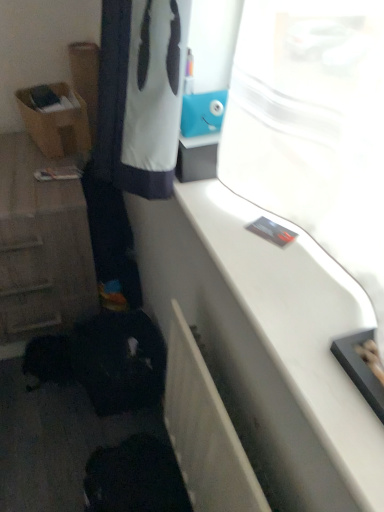
Question: Is wooden cabinet at left taller than white glossy counter top at upper right?

Choices:
 (A) yes
 (B) no

Answer: (A)

Question: Is wooden cabinet at left directly adjacent to white glossy counter top at upper right?

Choices:
 (A) yes
 (B) no

Answer: (B)

Question: Is wooden cabinet at left oriented towards white glossy counter top at upper right?

Choices:
 (A) no
 (B) yes

Answer: (A)

Question: Is the position of wooden cabinet at left less distant than that of white glossy counter top at upper right?

Choices:
 (A) yes
 (B) no

Answer: (B)

Question: Can you confirm if wooden cabinet at left is positioned to the left of white glossy counter top at upper right?

Choices:
 (A) yes
 (B) no

Answer: (A)

Question: From a real-world perspective, is brown cardboard box at left positioned above or below wooden cabinet at left?

Choices:
 (A) below
 (B) above

Answer: (B)

Question: From the image's perspective, is brown cardboard box at left positioned above or below wooden cabinet at left?

Choices:
 (A) above
 (B) below

Answer: (A)

Question: Is brown cardboard box at left inside the boundaries of wooden cabinet at left, or outside?

Choices:
 (A) inside
 (B) outside

Answer: (B)

Question: Is point (87, 135) closer or farther from the camera than point (13, 266)?

Choices:
 (A) closer
 (B) farther

Answer: (B)

Question: Considering the positions of brown cardboard box at left and white glossy counter top at upper right in the image, is brown cardboard box at left wider or thinner than white glossy counter top at upper right?

Choices:
 (A) wide
 (B) thin

Answer: (B)

Question: Is brown cardboard box at left situated inside white glossy counter top at upper right or outside?

Choices:
 (A) outside
 (B) inside

Answer: (A)

Question: Considering the positions of point (49, 118) and point (311, 477), is point (49, 118) closer or farther from the camera than point (311, 477)?

Choices:
 (A) farther
 (B) closer

Answer: (A)

Question: From a real-world perspective, is brown cardboard box at left positioned above or below white glossy counter top at upper right?

Choices:
 (A) below
 (B) above

Answer: (A)

Question: Is wooden cabinet at left wider or thinner than white glossy counter top at upper right?

Choices:
 (A) thin
 (B) wide

Answer: (B)

Question: In terms of size, does wooden cabinet at left appear bigger or smaller than white glossy counter top at upper right?

Choices:
 (A) small
 (B) big

Answer: (B)